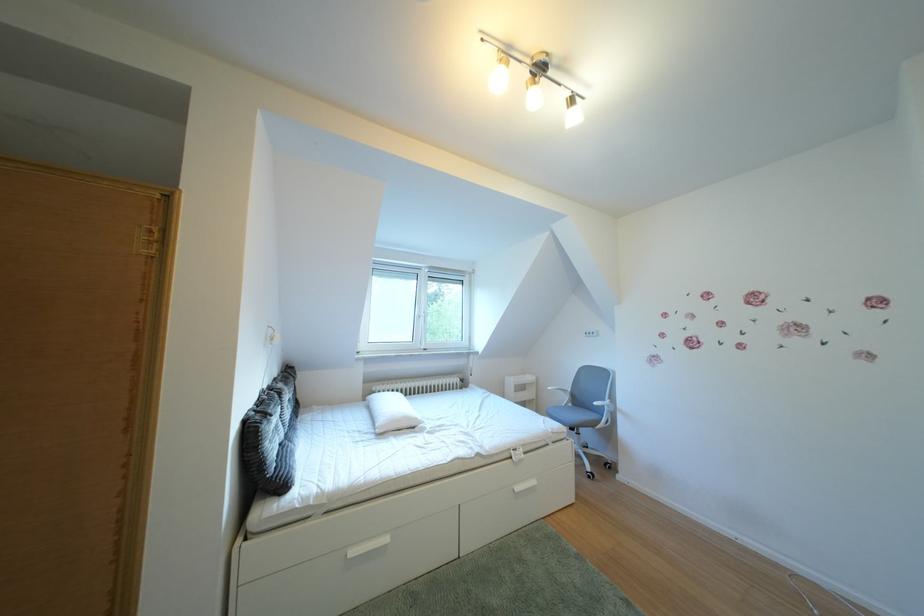
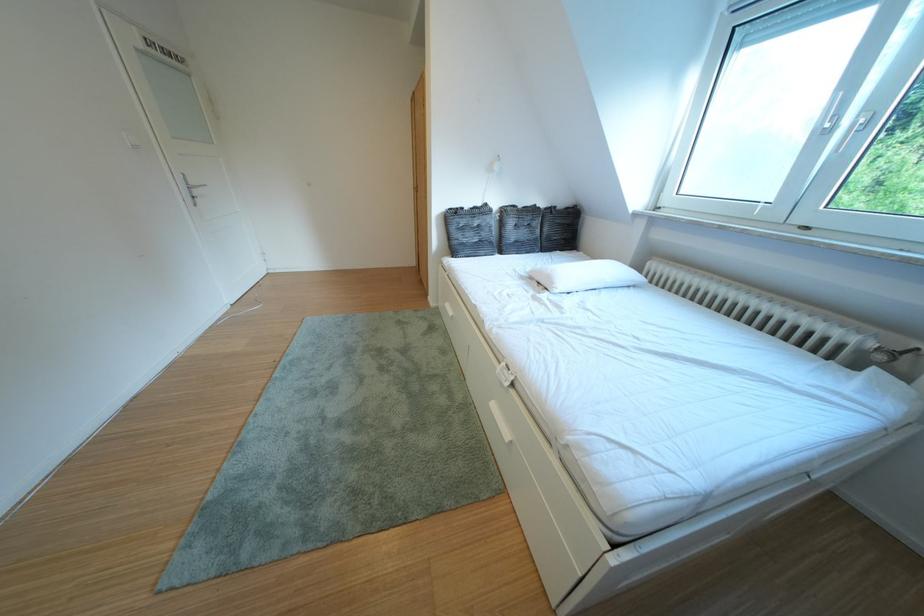
Where in the second image is the point corresponding to point 430,424 from the first image?

(565, 288)